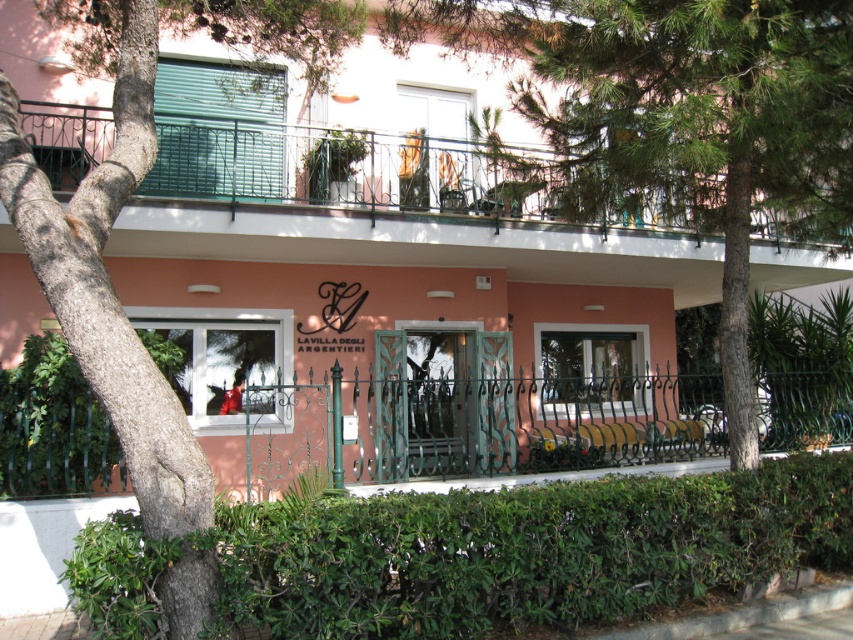
You are standing on the sidewalk outside the building and want to see the interior through the open doors. Which object, the metallic railing at upper center or the green leafy hedge at lower left, is shorter and might allow you a better view?

The metallic railing at upper center is not as tall as the green leafy hedge at lower left, so it is shorter and might allow a better view.